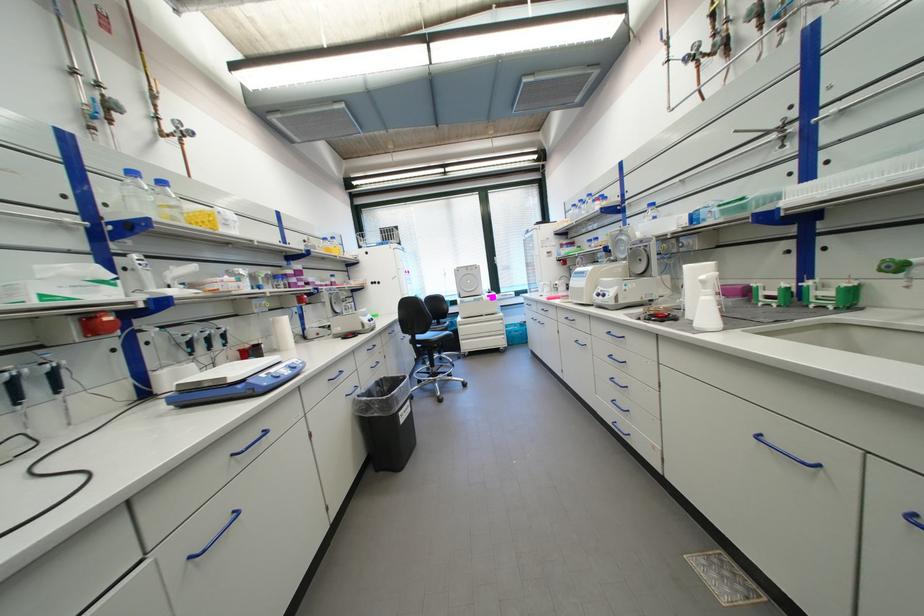
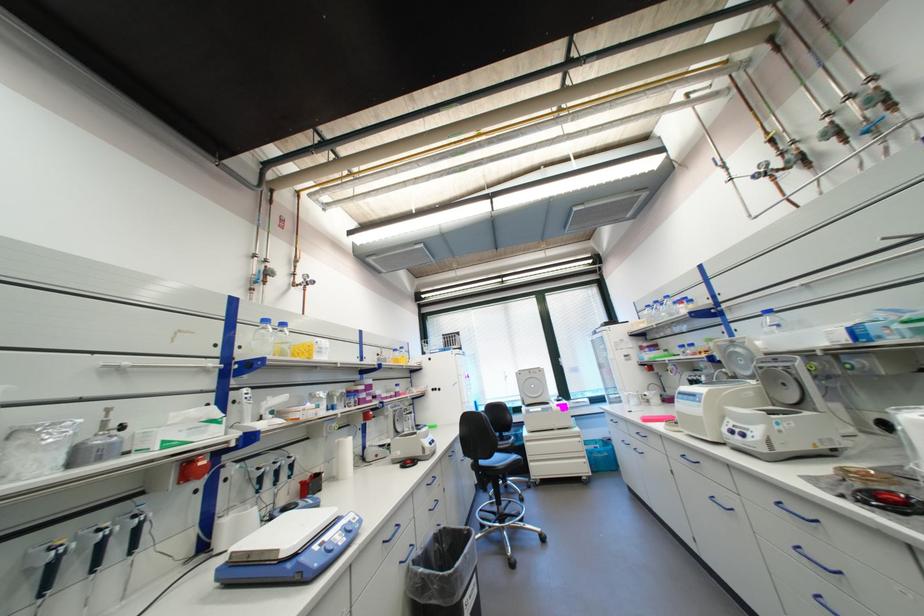
The point at (x=581, y=207) is marked in the first image. Where is the corresponding point in the second image?

(655, 307)